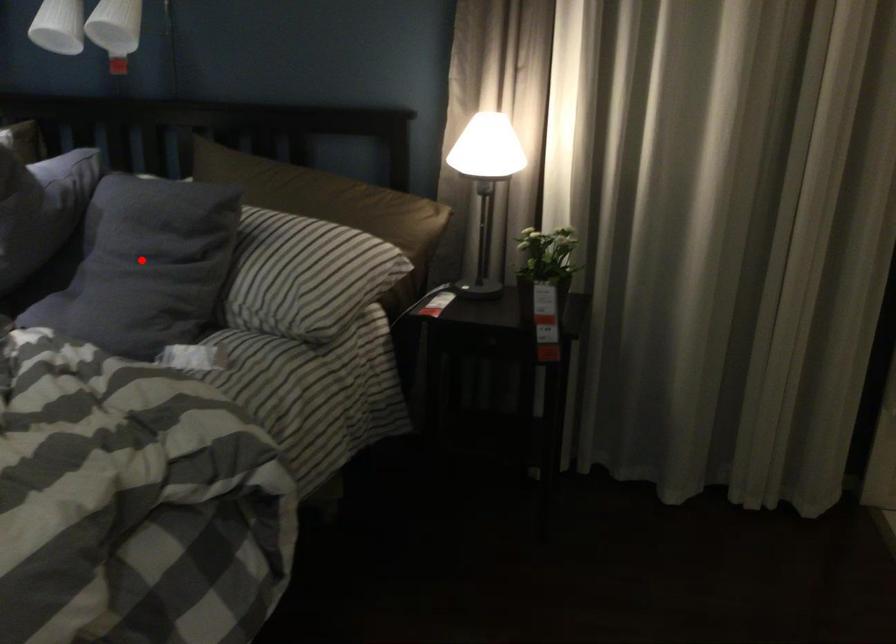
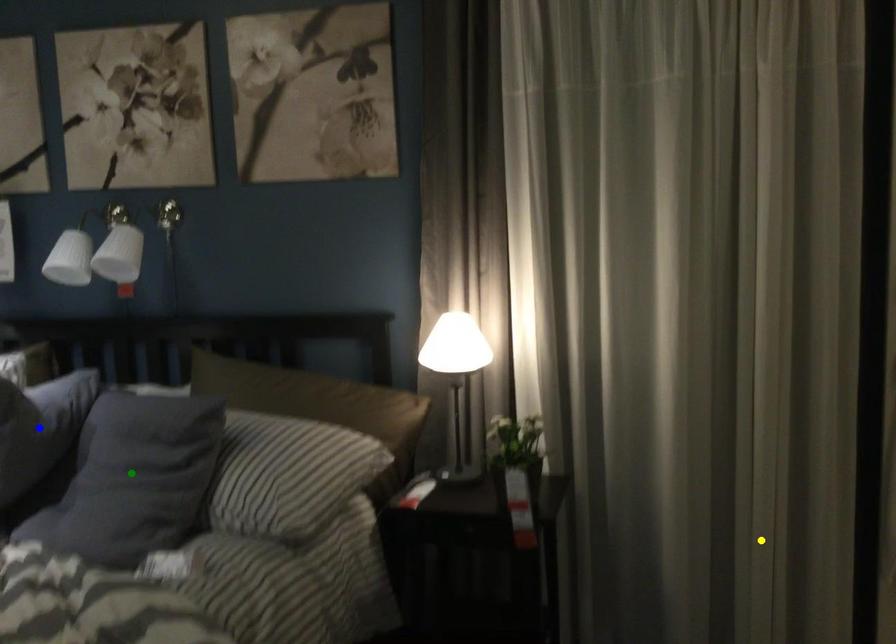
Question: I am providing you with two images of the same scene from different viewpoints. A red point is marked on the first image. You are given multiple points on the second image. Which spot in image 2 lines up with the point in image 1?

Choices:
 (A) yellow point
 (B) green point
 (C) blue point

Answer: (B)